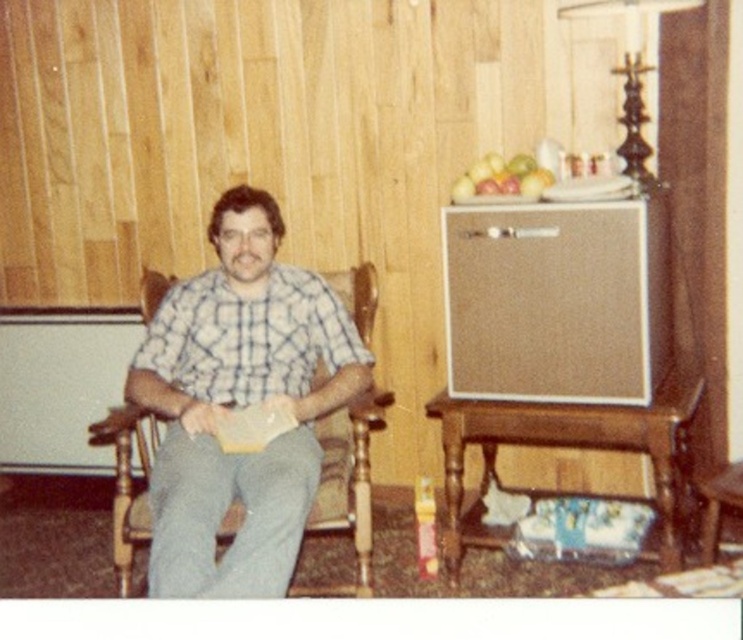
Question: Can you confirm if checkered fabric shirt at center is thinner than green matte apple at upper center?

Choices:
 (A) no
 (B) yes

Answer: (A)

Question: Among these objects, which one is farthest from the camera?

Choices:
 (A) green matte apple at upper center
 (B) checkered fabric shirt at center

Answer: (A)

Question: Does checkered fabric shirt at center have a greater width compared to green matte apple at upper center?

Choices:
 (A) no
 (B) yes

Answer: (B)

Question: Which of the following is the closest to the observer?

Choices:
 (A) checkered fabric shirt at center
 (B) green matte apple at upper center

Answer: (A)

Question: Can you confirm if checkered fabric shirt at center is positioned to the right of green matte apple at upper center?

Choices:
 (A) yes
 (B) no

Answer: (B)

Question: Which object is closer to the camera taking this photo?

Choices:
 (A) green matte apple at upper center
 (B) checkered fabric shirt at center

Answer: (B)